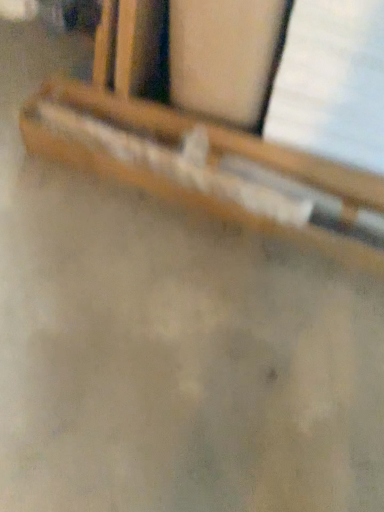
Identify the location of wooden chair at upper center. (186, 144).

Describe the element at coordinates (186, 144) in the screenshot. The height and width of the screenshot is (512, 384). I see `wooden chair at upper center` at that location.

This screenshot has width=384, height=512. Identify the location of wooden chair at upper center. (186, 144).